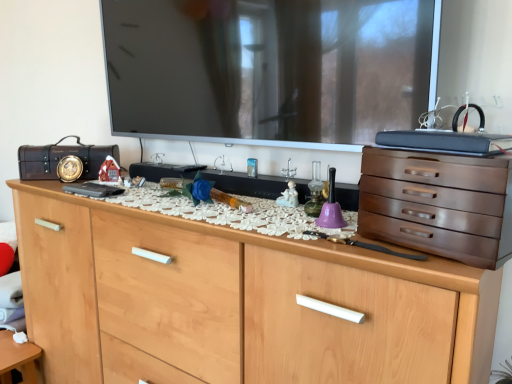
Question: Is matte black suitcase at left behind white porcelain figurine at center?

Choices:
 (A) no
 (B) yes

Answer: (B)

Question: Is matte black suitcase at left outside of white porcelain figurine at center?

Choices:
 (A) yes
 (B) no

Answer: (A)

Question: From the image's perspective, is matte black suitcase at left beneath white porcelain figurine at center?

Choices:
 (A) yes
 (B) no

Answer: (B)

Question: Considering the relative sizes of matte black suitcase at left and white porcelain figurine at center in the image provided, is matte black suitcase at left thinner than white porcelain figurine at center?

Choices:
 (A) no
 (B) yes

Answer: (A)

Question: From a real-world perspective, is matte black suitcase at left over white porcelain figurine at center?

Choices:
 (A) yes
 (B) no

Answer: (A)

Question: Considering the positions of white porcelain figurine at center and light wood chest of drawers at center, which is counted as the second chest of drawers, starting from the top, in the image, is white porcelain figurine at center wider or thinner than light wood chest of drawers at center, which is counted as the second chest of drawers, starting from the top,?

Choices:
 (A) thin
 (B) wide

Answer: (A)

Question: Considering the positions of point (278, 196) and point (263, 263), is point (278, 196) closer or farther from the camera than point (263, 263)?

Choices:
 (A) closer
 (B) farther

Answer: (B)

Question: From the image's perspective, is white porcelain figurine at center located above or below light wood chest of drawers at center, which is counted as the second chest of drawers, starting from the top?

Choices:
 (A) above
 (B) below

Answer: (A)

Question: Is white porcelain figurine at center inside the boundaries of light wood chest of drawers at center, which is counted as the second chest of drawers, starting from the top, or outside?

Choices:
 (A) outside
 (B) inside

Answer: (A)

Question: From a real-world perspective, relative to white porcelain figurine at center, is matte black suitcase at left vertically above or below?

Choices:
 (A) above
 (B) below

Answer: (A)

Question: Visually, is matte black suitcase at left positioned to the left or to the right of white porcelain figurine at center?

Choices:
 (A) left
 (B) right

Answer: (A)

Question: From the image's perspective, is matte black suitcase at left positioned above or below white porcelain figurine at center?

Choices:
 (A) below
 (B) above

Answer: (B)

Question: Is matte black suitcase at left situated inside white porcelain figurine at center or outside?

Choices:
 (A) outside
 (B) inside

Answer: (A)

Question: Looking at their shapes, would you say satin brown chest of drawers at right, which is counted as the 2th chest of drawers, starting from the bottom, is wider or thinner than white porcelain figurine at center?

Choices:
 (A) thin
 (B) wide

Answer: (B)

Question: From a real-world perspective, is satin brown chest of drawers at right, which is counted as the 2th chest of drawers, starting from the bottom, above or below white porcelain figurine at center?

Choices:
 (A) above
 (B) below

Answer: (A)